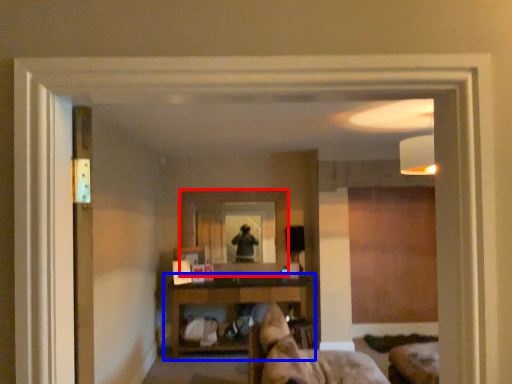
Question: Which object is further to the camera taking this photo, mirror (highlighted by a red box) or shelf (highlighted by a blue box)?

Choices:
 (A) mirror
 (B) shelf

Answer: (A)